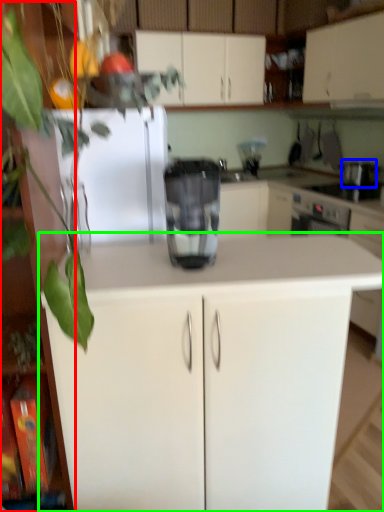
Question: Which object is the farthest from cabinetry (highlighted by a red box)? Choose among these: appliance (highlighted by a blue box) or cabinetry (highlighted by a green box).

Choices:
 (A) appliance
 (B) cabinetry

Answer: (A)